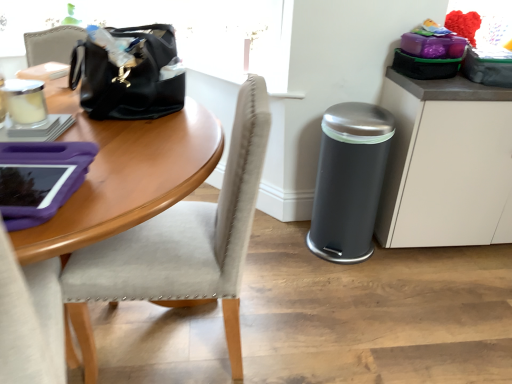
Question: Can you confirm if matte gray cabinet at right is positioned to the left of black leather handbag at upper left?

Choices:
 (A) yes
 (B) no

Answer: (B)

Question: Is matte gray cabinet at right closer to the viewer compared to black leather handbag at upper left?

Choices:
 (A) no
 (B) yes

Answer: (A)

Question: Is matte gray cabinet at right positioned with its back to black leather handbag at upper left?

Choices:
 (A) yes
 (B) no

Answer: (B)

Question: Could you tell me if matte gray cabinet at right is facing black leather handbag at upper left?

Choices:
 (A) yes
 (B) no

Answer: (B)

Question: Can you confirm if matte gray cabinet at right is wider than black leather handbag at upper left?

Choices:
 (A) no
 (B) yes

Answer: (B)

Question: Does matte gray cabinet at right have a lesser width compared to black leather handbag at upper left?

Choices:
 (A) no
 (B) yes

Answer: (A)

Question: From a real-world perspective, is light gray fabric chair at left positioned under black leather handbag at upper left based on gravity?

Choices:
 (A) yes
 (B) no

Answer: (A)

Question: Does light gray fabric chair at left turn towards black leather handbag at upper left?

Choices:
 (A) yes
 (B) no

Answer: (B)

Question: Is light gray fabric chair at left positioned behind black leather handbag at upper left?

Choices:
 (A) yes
 (B) no

Answer: (B)

Question: Considering the relative positions of light gray fabric chair at left and black leather handbag at upper left in the image provided, is light gray fabric chair at left in front of black leather handbag at upper left?

Choices:
 (A) yes
 (B) no

Answer: (A)

Question: From the image's perspective, is light gray fabric chair at left above black leather handbag at upper left?

Choices:
 (A) yes
 (B) no

Answer: (B)

Question: Does light gray fabric chair at left have a lesser width compared to black leather handbag at upper left?

Choices:
 (A) no
 (B) yes

Answer: (A)

Question: Is black leather handbag at upper left positioned behind matte gray cabinet at right?

Choices:
 (A) no
 (B) yes

Answer: (A)